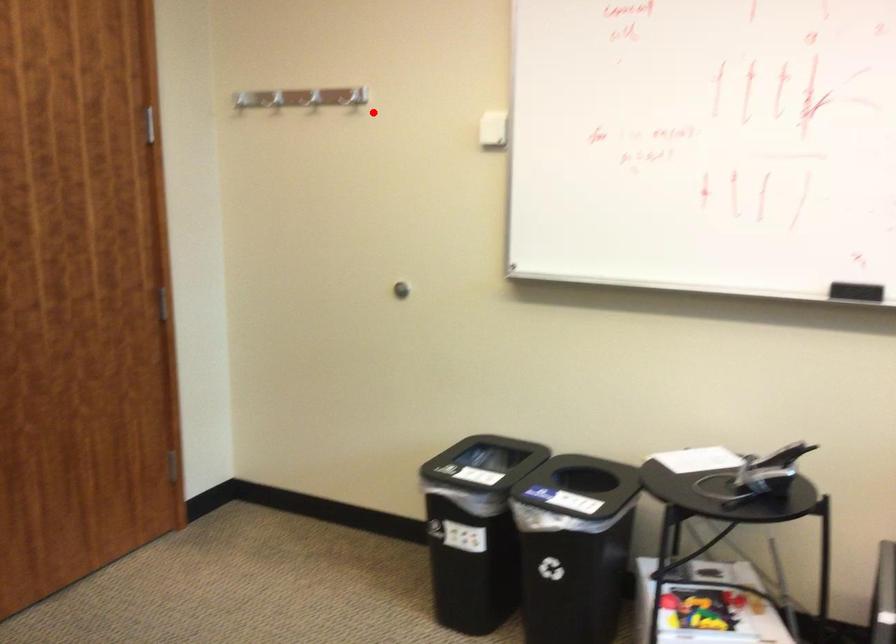
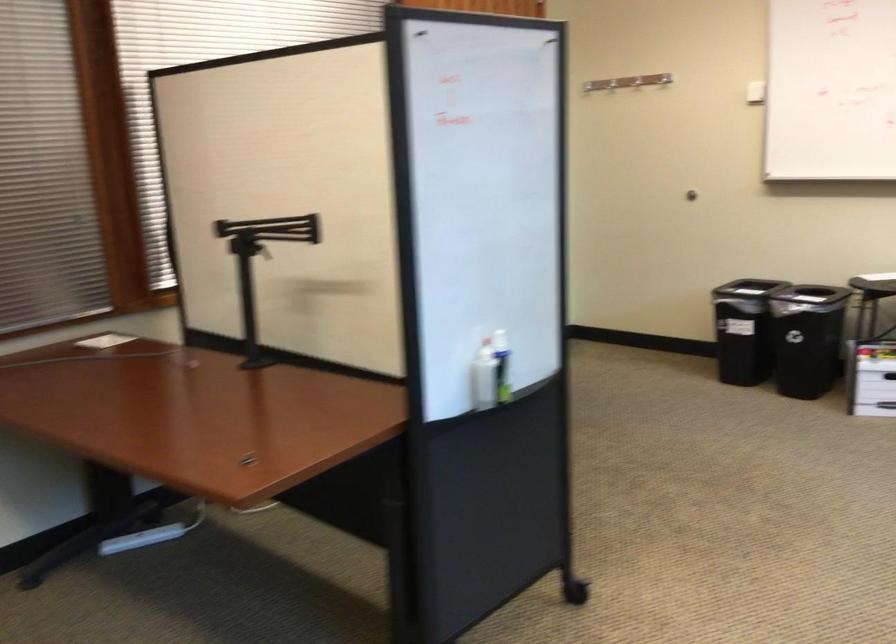
Question: A red point is marked in image1. In image2, is the corresponding 3D point closer to the camera or farther? Reply with the corresponding letter.

Choices:
 (A) The corresponding 3D point is closer.
 (B) The corresponding 3D point is farther.

Answer: (B)